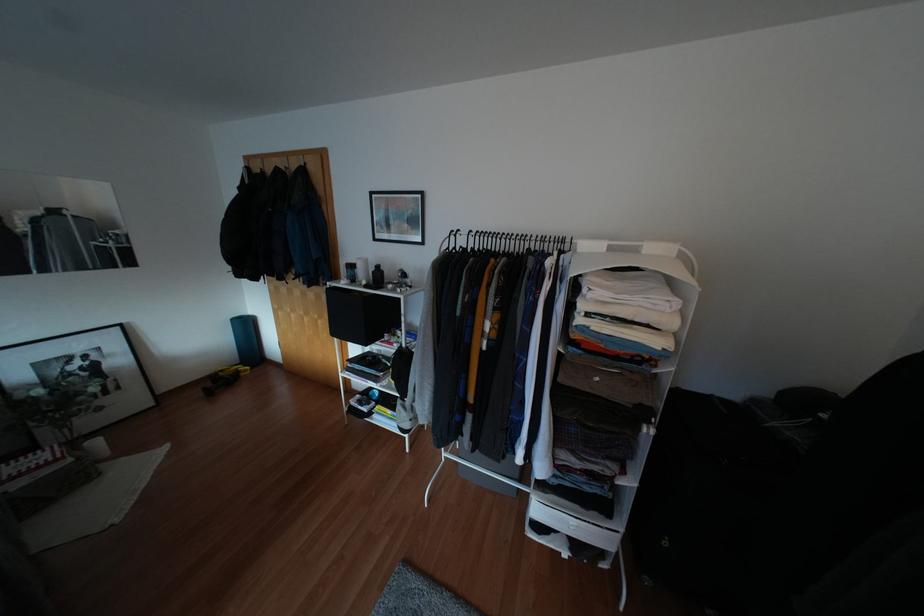
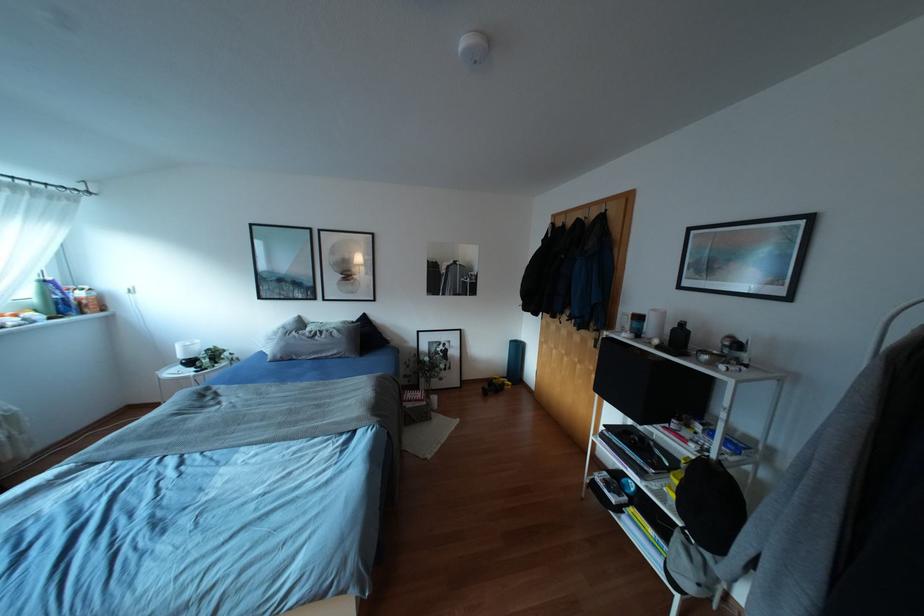
Question: The camera is either moving clockwise (left) or counter-clockwise (right) around the object. The first image is from the beginning of the video and the second image is from the end. Is the camera moving left or right when shooting the video?

Choices:
 (A) Left
 (B) Right

Answer: (B)